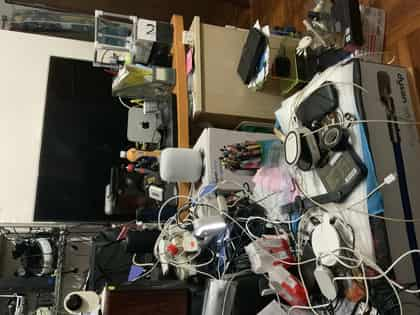
This screenshot has width=420, height=315. I want to click on smaller white cardboard box, so click(x=374, y=22).